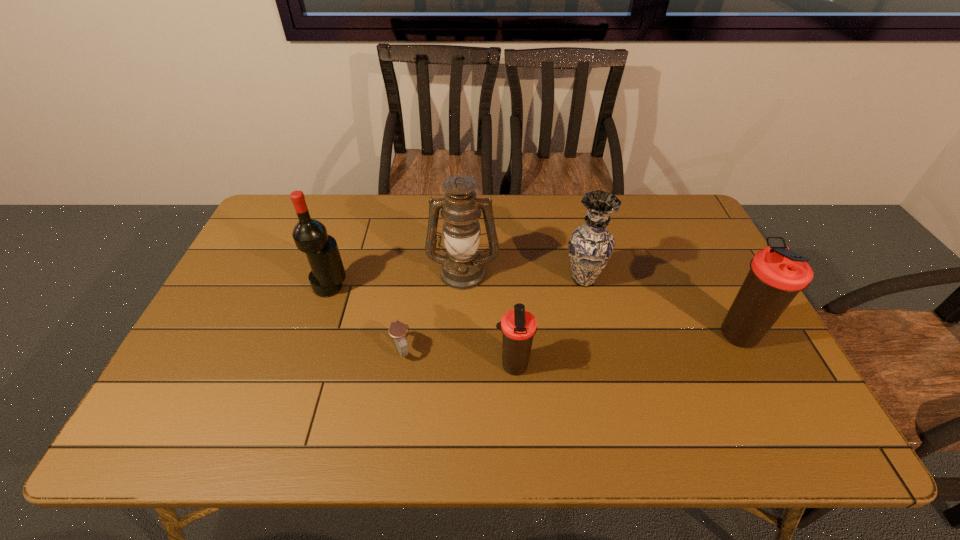
Locate an element on the screen. Image resolution: width=960 pixels, height=540 pixels. the shorter thermos bottle is located at coordinates (518, 326).

The height and width of the screenshot is (540, 960). I want to click on the second shortest object, so click(518, 326).

You are a GUI agent. You are given a task and a screenshot of the screen. Output one action in this format:
    pyautogui.click(x=<x>, y=<y>)
    Task: Click on the taller thermos bottle
    
    Given the screenshot: What is the action you would take?
    pyautogui.click(x=777, y=274)

You are a GUI agent. You are given a task and a screenshot of the screen. Output one action in this format:
    pyautogui.click(x=<x>, y=<y>)
    Task: Click on the rightmost object
    
    Given the screenshot: What is the action you would take?
    pyautogui.click(x=777, y=274)

In order to click on the second object from right to left in this screenshot , I will do tap(590, 246).

Locate an element on the screen. oil lamp is located at coordinates (463, 268).

The width and height of the screenshot is (960, 540). I want to click on wine bottle, so click(310, 236).

Image resolution: width=960 pixels, height=540 pixels. In order to click on watch in this screenshot , I will do `click(397, 330)`.

Find the location of a particular element. The image size is (960, 540). the shortest object is located at coordinates (397, 330).

Locate an element on the screen. vacant space situated on the left of the shorter thermos bottle is located at coordinates (365, 366).